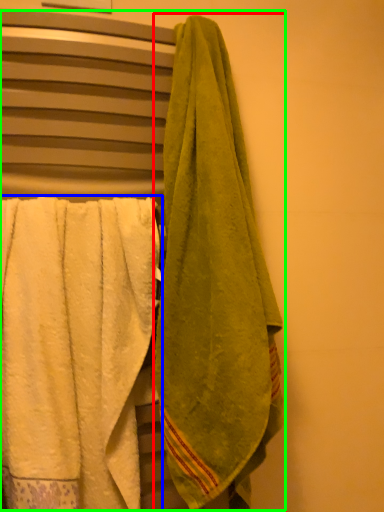
Question: Based on their relative distances, which object is farther from towel (highlighted by a red box)? Choose from towel (highlighted by a blue box) and laundry (highlighted by a green box).

Choices:
 (A) towel
 (B) laundry

Answer: (A)